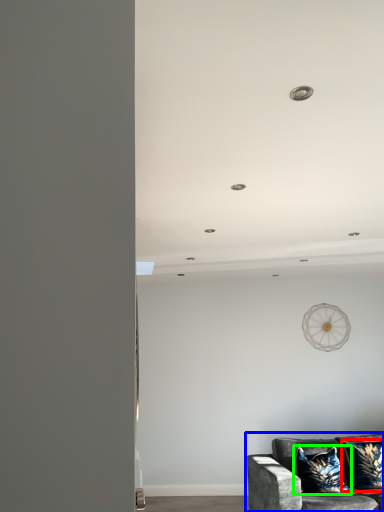
Question: Considering the real-world distances, which object is farthest from pillow (highlighted by a red box)? studio couch (highlighted by a blue box) or pillow (highlighted by a green box)?

Choices:
 (A) studio couch
 (B) pillow

Answer: (A)